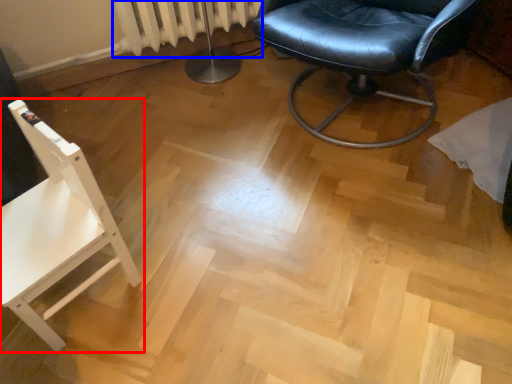
Question: Which object is closer to the camera taking this photo, chair (highlighted by a red box) or radiator (highlighted by a blue box)?

Choices:
 (A) chair
 (B) radiator

Answer: (A)